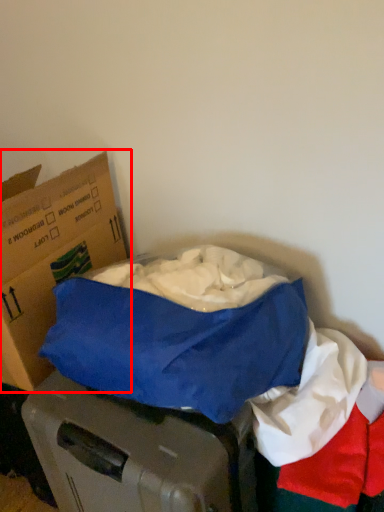
Question: Considering the relative positions of box (annotated by the red box) and linen in the image provided, where is box (annotated by the red box) located with respect to the staircase?

Choices:
 (A) left
 (B) right

Answer: (A)